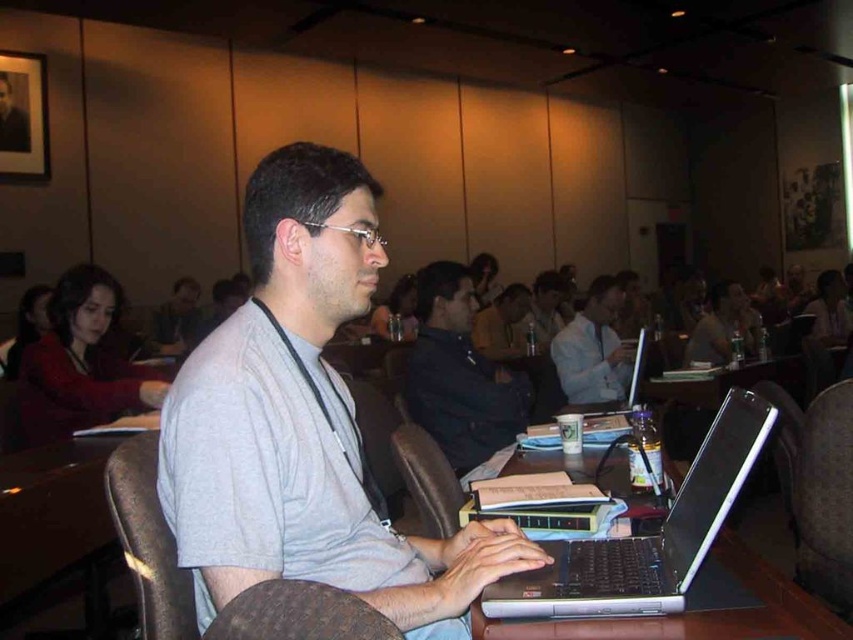
Between brown textured fabric at lower center and light blue shirt at center, which one has less height?

brown textured fabric at lower center is shorter.

Is brown textured fabric at lower center closer to camera compared to light blue shirt at center?

Yes, brown textured fabric at lower center is closer to the viewer.

Is point (337, 589) farther from camera compared to point (608, 348)?

No, (337, 589) is in front of (608, 348).

This screenshot has width=853, height=640. Find the location of `brown textured fabric at lower center`. brown textured fabric at lower center is located at coordinates (299, 614).

Based on the photo, is brown leather chair at lower right bigger than matte black laptop at center?

No, brown leather chair at lower right is not bigger than matte black laptop at center.

Is brown leather chair at lower right below matte black laptop at center?

Yes, brown leather chair at lower right is below matte black laptop at center.

Is point (827, 582) farther from camera compared to point (494, 330)?

No, (827, 582) is closer to viewer.

Locate an element on the screen. The image size is (853, 640). brown leather chair at lower right is located at coordinates (817, 486).

Based on the photo, which is above, brown leather chair at lower left or brown leather chair at center?

Positioned higher is brown leather chair at lower left.

Describe the element at coordinates (148, 541) in the screenshot. I see `brown leather chair at lower left` at that location.

In order to click on brown leather chair at lower left in this screenshot , I will do [x=148, y=541].